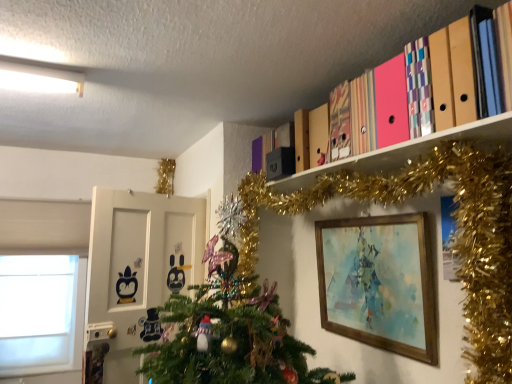
What is the approximate height of white matte window at left?

white matte window at left is 1.21 meters in height.

The height and width of the screenshot is (384, 512). What do you see at coordinates (42, 318) in the screenshot? I see `white matte window at left` at bounding box center [42, 318].

What is the approximate height of matte cardboard folders at upper right?

The height of matte cardboard folders at upper right is 1.69 inches.

You are a GUI agent. You are given a task and a screenshot of the screen. Output one action in this format:
    pyautogui.click(x=<x>, y=<y>)
    Task: Click on the white matte window at left
    This screenshot has width=512, height=384.
    Given the screenshot: What is the action you would take?
    pyautogui.click(x=42, y=318)

Is green matte christmas tree at upper right placed right next to wooden picture frame at lower right?

No, green matte christmas tree at upper right is not making contact with wooden picture frame at lower right.

From a real-world perspective, does green matte christmas tree at upper right sit lower than wooden picture frame at lower right?

Actually, green matte christmas tree at upper right is physically above wooden picture frame at lower right in the real world.

How distant is green matte christmas tree at upper right from wooden picture frame at lower right?

A distance of 12.53 inches exists between green matte christmas tree at upper right and wooden picture frame at lower right.

Where is `christmas tree in front of the wooden picture frame at lower right`? This screenshot has width=512, height=384. christmas tree in front of the wooden picture frame at lower right is located at coordinates (456, 236).

Considering the relative positions of white matte window at left and wooden picture frame at lower right in the image provided, is white matte window at left to the left or to the right of wooden picture frame at lower right?

white matte window at left is positioned on wooden picture frame at lower right's left side.

Considering the sizes of objects white matte window at left and wooden picture frame at lower right in the image provided, who is shorter, white matte window at left or wooden picture frame at lower right?

Standing shorter between the two is wooden picture frame at lower right.

Looking at their sizes, would you say white matte window at left is wider or thinner than wooden picture frame at lower right?

Clearly, white matte window at left has more width compared to wooden picture frame at lower right.

Where is `picture frame above the white matte window at left (from the image's perspective)`? picture frame above the white matte window at left (from the image's perspective) is located at coordinates (379, 283).

Is wooden picture frame at lower right situated inside white matte window at left or outside?

wooden picture frame at lower right is not enclosed by white matte window at left.

Is wooden picture frame at lower right oriented away from white matte window at left?

No, white matte window at left is not at the back of wooden picture frame at lower right.

From the image's perspective, is wooden picture frame at lower right on white matte window at left?

Yes, from the image's perspective, wooden picture frame at lower right is above white matte window at left.

From a real-world perspective, is green matte christmas tree at upper right physically located above or below white matte window at left?

From a real-world perspective, green matte christmas tree at upper right is physically above white matte window at left.

In terms of size, does green matte christmas tree at upper right appear bigger or smaller than white matte window at left?

Clearly, green matte christmas tree at upper right is larger in size than white matte window at left.

Which object is further away from the camera, green matte christmas tree at upper right or white matte window at left?

white matte window at left is further away from the camera.

Considering the positions of objects wooden picture frame at lower right and matte cardboard folders at upper right in the image provided, who is more to the left, wooden picture frame at lower right or matte cardboard folders at upper right?

matte cardboard folders at upper right.

Is wooden picture frame at lower right aimed at matte cardboard folders at upper right?

No.

Considering the positions of point (339, 284) and point (498, 138), is point (339, 284) closer or farther from the camera than point (498, 138)?

Point (339, 284).

This screenshot has width=512, height=384. In order to click on picture frame below the matte cardboard folders at upper right (from the image's perspective) in this screenshot , I will do `click(379, 283)`.

Which object is closer to the camera taking this photo, white matte window at left or green matte christmas tree at upper right?

green matte christmas tree at upper right is closer to the camera.

Measure the distance between white matte window at left and green matte christmas tree at upper right.

The distance of white matte window at left from green matte christmas tree at upper right is 6.73 feet.

Is white matte window at left facing towards green matte christmas tree at upper right?

No.

Looking at their sizes, would you say white matte window at left is wider or thinner than green matte christmas tree at upper right?

Considering their sizes, white matte window at left looks slimmer than green matte christmas tree at upper right.

From a real-world perspective, is matte cardboard folders at upper right on white matte window at left?

Yes, from a real-world perspective, matte cardboard folders at upper right is above white matte window at left.

In the scene shown: Can white matte window at left be found inside matte cardboard folders at upper right?

Definitely not — white matte window at left is not inside matte cardboard folders at upper right.

Which object is closer to the camera, matte cardboard folders at upper right or white matte window at left?

matte cardboard folders at upper right.

In the image, there is a wooden picture frame at lower right. Find the location of `christmas tree above it (from the image's perspective)`. christmas tree above it (from the image's perspective) is located at coordinates (456, 236).

This screenshot has height=384, width=512. I want to click on window below the wooden picture frame at lower right (from a real-world perspective), so click(x=42, y=318).

In the scene shown: From the image, which object appears to be nearer to green matte christmas tree at upper right, wooden picture frame at lower right or matte cardboard folders at upper right?

matte cardboard folders at upper right is closer to green matte christmas tree at upper right.

When comparing their distances from wooden picture frame at lower right, does white matte window at left or matte cardboard folders at upper right seem further?

white matte window at left lies further to wooden picture frame at lower right than the other object.

From the image, which object appears to be nearer to green matte christmas tree at upper right, wooden picture frame at lower right or white matte window at left?

wooden picture frame at lower right is closer to green matte christmas tree at upper right.

Considering their positions, is matte cardboard folders at upper right positioned closer to green matte christmas tree at upper right than wooden picture frame at lower right?

matte cardboard folders at upper right.

From the image, which object appears to be farther from matte cardboard folders at upper right, white matte window at left or wooden picture frame at lower right?

white matte window at left lies further to matte cardboard folders at upper right than the other object.

Which object lies nearer to the anchor point white matte window at left, green matte christmas tree at upper right or wooden picture frame at lower right?

Among the two, green matte christmas tree at upper right is located nearer to white matte window at left.

Looking at the image, which one is located closer to matte cardboard folders at upper right, white matte window at left or green matte christmas tree at upper right?

green matte christmas tree at upper right lies closer to matte cardboard folders at upper right than the other object.

Looking at this image, when comparing their distances from green matte christmas tree at upper right, does white matte window at left or matte cardboard folders at upper right seem further?

white matte window at left.

Find the location of `christmas tree located between white matte window at left and wooden picture frame at lower right in the left-right direction`. christmas tree located between white matte window at left and wooden picture frame at lower right in the left-right direction is located at coordinates (456, 236).

Identify the location of christmas tree between white matte window at left and matte cardboard folders at upper right. (456, 236).

Locate an element on the screen. shelf between white matte window at left and wooden picture frame at lower right in the horizontal direction is located at coordinates (405, 151).

This screenshot has height=384, width=512. I want to click on shelf between green matte christmas tree at upper right and wooden picture frame at lower right in the front-back direction, so click(405, 151).